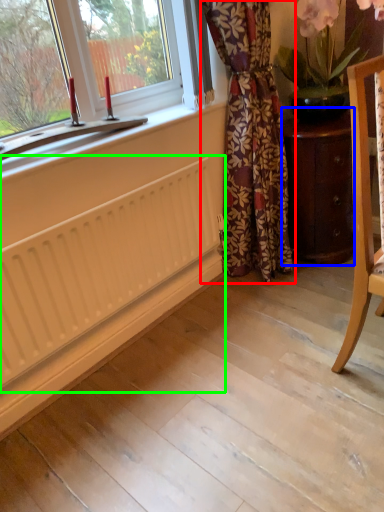
Question: Which is farther away from curtain (highlighted by a red box)? furniture (highlighted by a blue box) or radiator (highlighted by a green box)?

Choices:
 (A) furniture
 (B) radiator

Answer: (B)